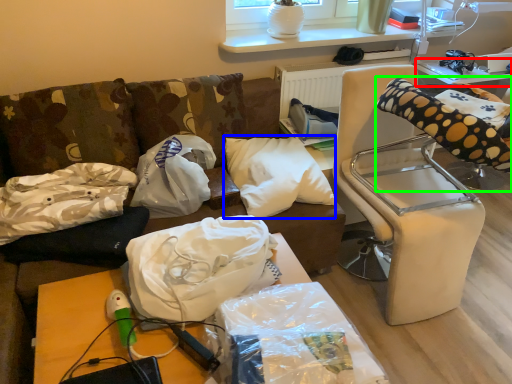
Question: Estimate the real-world distances between objects in this image. Which object is farther from table (highlighted by a red box), pillow (highlighted by a blue box) or bean bag chair (highlighted by a green box)?

Choices:
 (A) pillow
 (B) bean bag chair

Answer: (A)